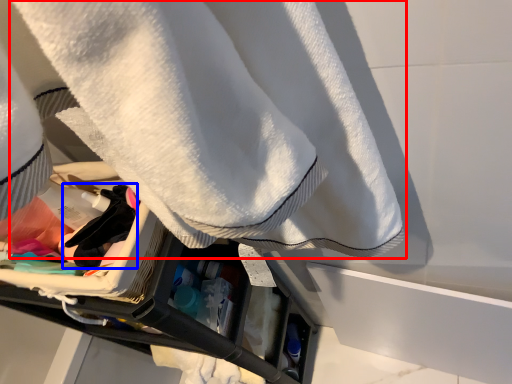
Question: Which object appears closest to the camera in this image, towel (highlighted by a red box) or clothing (highlighted by a blue box)?

Choices:
 (A) towel
 (B) clothing

Answer: (A)